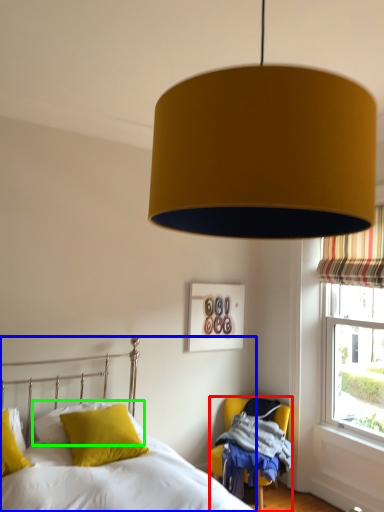
Question: Estimate the real-world distances between objects in this image. Which object is farther from chair (highlighted by a red box), bed (highlighted by a blue box) or pillow (highlighted by a green box)?

Choices:
 (A) bed
 (B) pillow

Answer: (A)